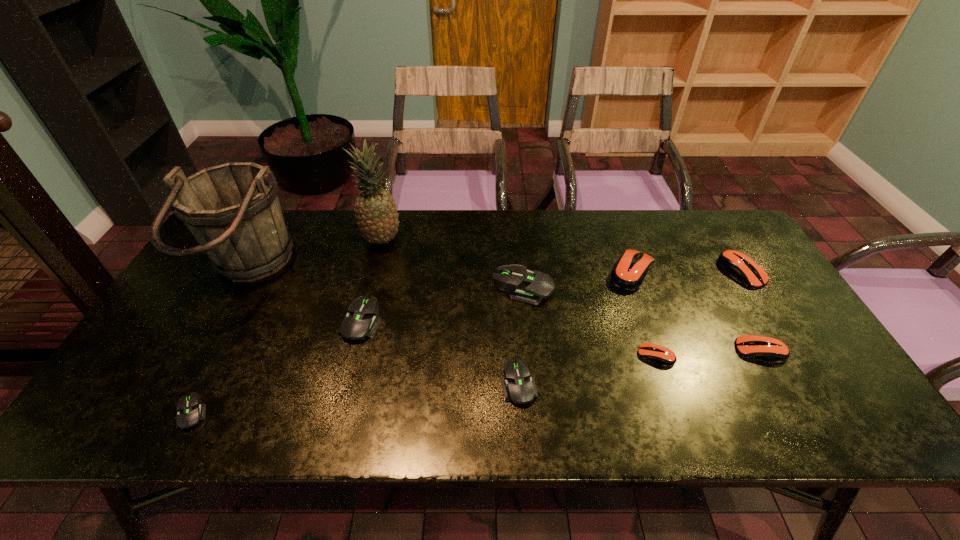
Find the location of a particular element. pineapple is located at coordinates (375, 210).

Where is `bucket`? Image resolution: width=960 pixels, height=540 pixels. bucket is located at coordinates (233, 211).

This screenshot has width=960, height=540. Find the location of `the biggest orange computer mouse`. the biggest orange computer mouse is located at coordinates (629, 272).

Identify the location of the biggest gray computer mouse. The height and width of the screenshot is (540, 960). (523, 285).

Where is `the third smallest orange computer mouse`? the third smallest orange computer mouse is located at coordinates (736, 263).

Where is `the third smallest gray computer mouse`? the third smallest gray computer mouse is located at coordinates (360, 322).

This screenshot has width=960, height=540. I want to click on the seventh computer mouse from right to left, so click(360, 322).

This screenshot has width=960, height=540. In order to click on the third biggest orange computer mouse in this screenshot , I will do `click(770, 349)`.

This screenshot has height=540, width=960. Identify the location of the third biggest gray computer mouse. (519, 387).

Identify the location of the smallest orange computer mouse. The image size is (960, 540). (661, 355).